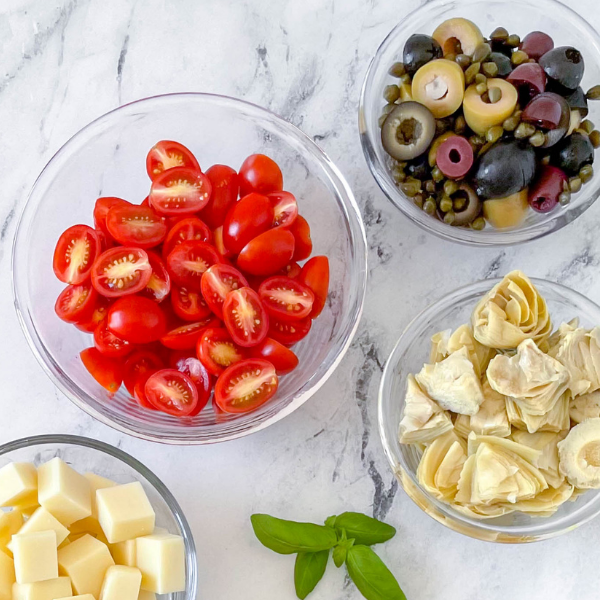
Where is `bowl`? This screenshot has height=600, width=600. bowl is located at coordinates (464, 232).